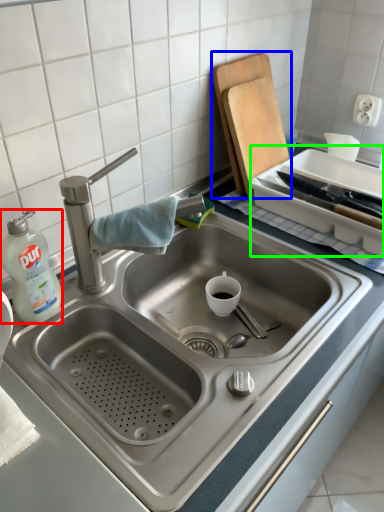
Question: Considering the real-world distances, which object is farthest from cleaning product (highlighted by a red box)? cutting board (highlighted by a blue box) or appliance (highlighted by a green box)?

Choices:
 (A) cutting board
 (B) appliance

Answer: (B)